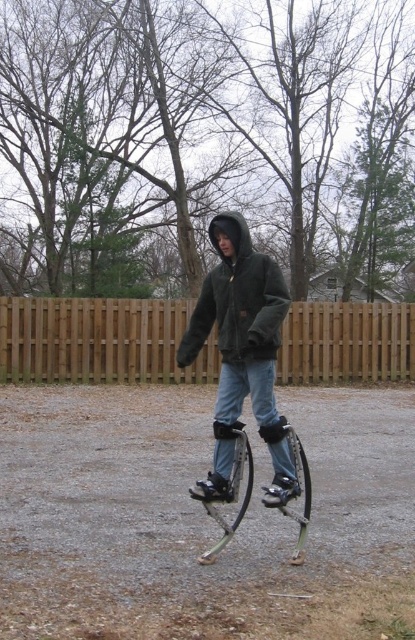
Question: Which point is closer to the camera?

Choices:
 (A) (171, 344)
 (B) (251, 392)
 (C) (237, 426)

Answer: (B)

Question: Considering the real-world distances, which object is farthest from the green fuzzy jacket at center?

Choices:
 (A) silver metallic stilts at center
 (B) brown wooden fence at center

Answer: (B)

Question: Does brown wooden fence at center appear over green fuzzy jacket at center?

Choices:
 (A) no
 (B) yes

Answer: (A)

Question: Which of these objects is positioned farthest from the brown wooden fence at center?

Choices:
 (A) silver metallic stilts at center
 (B) green fuzzy jacket at center

Answer: (B)

Question: Does green fuzzy jacket at center have a smaller size compared to silver metallic stilts at center?

Choices:
 (A) no
 (B) yes

Answer: (B)

Question: Is green fuzzy jacket at center further to the viewer compared to silver metallic stilts at center?

Choices:
 (A) no
 (B) yes

Answer: (A)